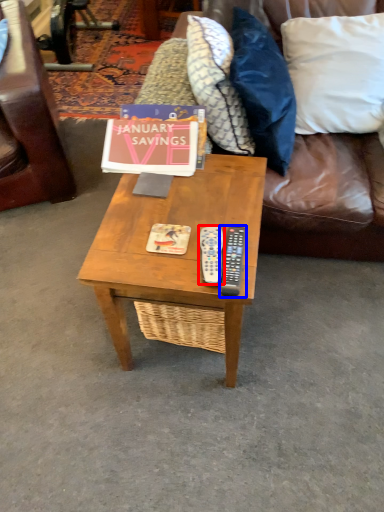
Question: Which object appears farthest to the camera in this image, remote (highlighted by a red box) or remote (highlighted by a blue box)?

Choices:
 (A) remote
 (B) remote

Answer: (A)